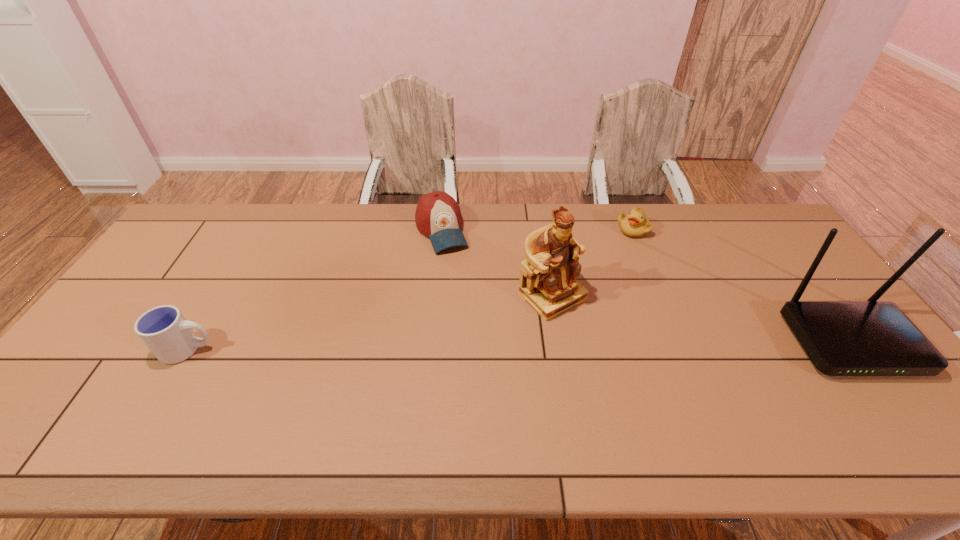
Where is `vacant region located 0.160m on the front-facing side of the baseball cap`? vacant region located 0.160m on the front-facing side of the baseball cap is located at coordinates (464, 287).

Where is `vacant space located 0.130m on the front-facing side of the figurine`? This screenshot has height=540, width=960. vacant space located 0.130m on the front-facing side of the figurine is located at coordinates (608, 349).

You are a GUI agent. You are given a task and a screenshot of the screen. Output one action in this format:
    pyautogui.click(x=<x>, y=<y>)
    Task: Click on the vacant space situated on the front-facing side of the figurine
    This screenshot has width=960, height=540.
    Given the screenshot: What is the action you would take?
    pyautogui.click(x=610, y=352)

The image size is (960, 540). What are the coordinates of `vacant position located on the front-facing side of the figurine` in the screenshot? It's located at (645, 386).

The height and width of the screenshot is (540, 960). I want to click on free space located 0.300m on the front-facing side of the duckling, so click(604, 295).

You are a GUI agent. You are given a task and a screenshot of the screen. Output one action in this format:
    pyautogui.click(x=<x>, y=<y>)
    Task: Click on the vacant space positioned on the front-facing side of the duckling
    This screenshot has height=540, width=960.
    Given the screenshot: What is the action you would take?
    pyautogui.click(x=595, y=316)

The height and width of the screenshot is (540, 960). I want to click on vacant space located on the front-facing side of the duckling, so click(x=617, y=265).

Find the location of a particular element. This screenshot has width=960, height=540. baseball cap that is at the far edge is located at coordinates (438, 216).

Where is `duckling present at the far edge`? duckling present at the far edge is located at coordinates (636, 224).

Where is `object located at the right edge`? This screenshot has height=540, width=960. object located at the right edge is located at coordinates (842, 338).